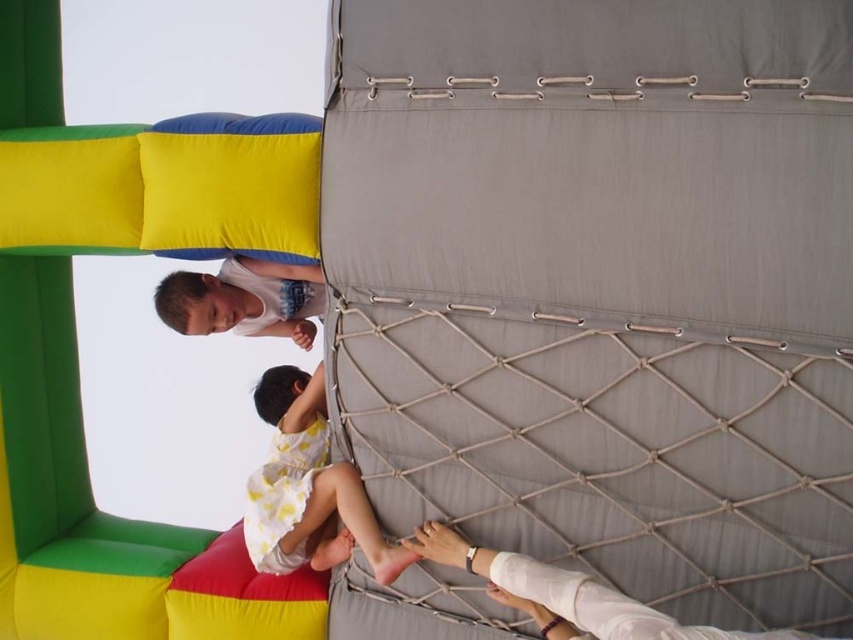
Question: Which is farther from the matte white shirt at upper left?

Choices:
 (A) white bandaged arm at center
 (B) white cotton dress at lower center
 (C) soft yellow cushion at upper left

Answer: (A)

Question: Among these points, which one is farthest from the camera?

Choices:
 (A) (268, 384)
 (B) (209, 576)

Answer: (A)

Question: Can you confirm if soft yellow cushion at upper left is smaller than matte white shirt at upper left?

Choices:
 (A) yes
 (B) no

Answer: (B)

Question: Which point appears farthest from the camera in this image?

Choices:
 (A) (540, 579)
 (B) (9, 216)

Answer: (B)

Question: Is white cotton dress at lower center thinner than white bandaged arm at center?

Choices:
 (A) yes
 (B) no

Answer: (A)

Question: Does soft yellow cushion at upper left have a larger size compared to white bandaged arm at center?

Choices:
 (A) no
 (B) yes

Answer: (B)